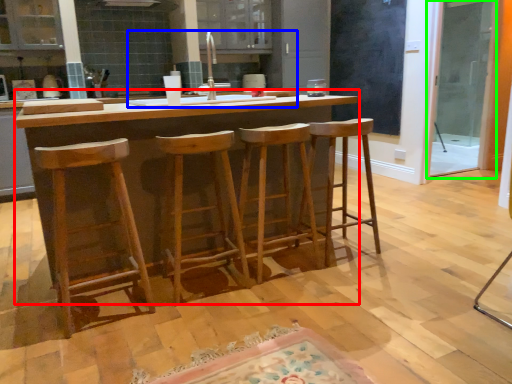
Question: Based on their relative distances, which object is nearer to table (highlighted by a red box)? Choose from sink (highlighted by a blue box) and screen door (highlighted by a green box).

Choices:
 (A) sink
 (B) screen door

Answer: (A)